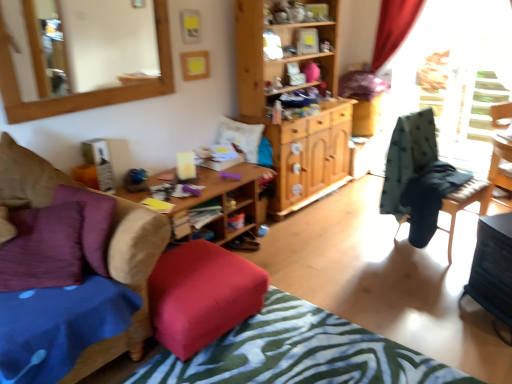
You are a GUI agent. You are given a task and a screenshot of the screen. Output one action in this format:
    pyautogui.click(x=<x>, y=<y>)
    Task: Click on the free point to the left of black glossy table at lower right
    This screenshot has height=384, width=512.
    Given the screenshot: What is the action you would take?
    pyautogui.click(x=448, y=319)